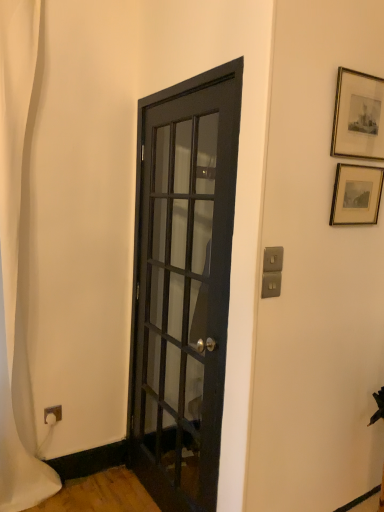
Describe the element at coordinates (356, 195) in the screenshot. This screenshot has width=384, height=512. I see `gold-framed picture at upper right, which is the first picture frame from bottom to top` at that location.

This screenshot has width=384, height=512. I want to click on matte black door at center, so click(183, 285).

I want to click on gold-framed picture at upper right, which appears as the second picture frame when viewed from the top, so click(356, 195).

Is gold-framed print at upper right, the second picture frame in the bottom-to-top sequence, outside of gold-framed picture at upper right, which appears as the second picture frame when viewed from the top?

Yes, gold-framed print at upper right, the second picture frame in the bottom-to-top sequence, is outside of gold-framed picture at upper right, which appears as the second picture frame when viewed from the top.

From a real-world perspective, who is located lower, gold-framed print at upper right, which is the first picture frame from top to bottom, or gold-framed picture at upper right, which appears as the second picture frame when viewed from the top?

gold-framed picture at upper right, which appears as the second picture frame when viewed from the top, is physically lower.

Between gold-framed print at upper right, the second picture frame in the bottom-to-top sequence, and gold-framed picture at upper right, which is the first picture frame from bottom to top, which one is positioned in front?

gold-framed print at upper right, the second picture frame in the bottom-to-top sequence.

Which object is wider, gold-framed print at upper right, the second picture frame in the bottom-to-top sequence, or gold-framed picture at upper right, which appears as the second picture frame when viewed from the top?

With larger width is gold-framed picture at upper right, which appears as the second picture frame when viewed from the top.

In the scene shown: Measure the distance between matte black door at center and white fabric shower curtain at left.

The distance of matte black door at center from white fabric shower curtain at left is 28.90 inches.

From the image's perspective, which one is positioned higher, matte black door at center or white fabric shower curtain at left?

white fabric shower curtain at left.

Based on the photo, can you tell me how much matte black door at center and white fabric shower curtain at left differ in facing direction?

There is a 90-degree angle between the facing directions of matte black door at center and white fabric shower curtain at left.

Is matte black door at center behind white fabric shower curtain at left?

No, matte black door at center is in front of white fabric shower curtain at left.

Locate an element on the screen. The height and width of the screenshot is (512, 384). picture frame that is the 2nd one when counting rightward from the white fabric shower curtain at left is located at coordinates 358,116.

Is gold-framed print at upper right, which is the first picture frame from top to bottom, to the left of white fabric shower curtain at left from the viewer's perspective?

Incorrect, gold-framed print at upper right, which is the first picture frame from top to bottom, is not on the left side of white fabric shower curtain at left.

Is gold-framed print at upper right, the second picture frame in the bottom-to-top sequence, wider than white fabric shower curtain at left?

Incorrect, the width of gold-framed print at upper right, the second picture frame in the bottom-to-top sequence, does not surpass that of white fabric shower curtain at left.

From a real-world perspective, is gold-framed picture at upper right, which appears as the second picture frame when viewed from the top, positioned above or below white fabric shower curtain at left?

In terms of real-world spatial position, gold-framed picture at upper right, which appears as the second picture frame when viewed from the top, is above white fabric shower curtain at left.

Which of these two, gold-framed picture at upper right, which appears as the second picture frame when viewed from the top, or white fabric shower curtain at left, stands shorter?

gold-framed picture at upper right, which appears as the second picture frame when viewed from the top, is shorter.

Locate an element on the screen. This screenshot has height=512, width=384. shower curtain located below the gold-framed picture at upper right, which is the first picture frame from bottom to top (from the image's perspective) is located at coordinates (15, 246).

Considering the positions of objects gold-framed picture at upper right, which is the first picture frame from bottom to top, and white fabric shower curtain at left in the image provided, who is more to the right, gold-framed picture at upper right, which is the first picture frame from bottom to top, or white fabric shower curtain at left?

gold-framed picture at upper right, which is the first picture frame from bottom to top, is more to the right.

Which is farther, (218, 283) or (336, 179)?

The point (218, 283) is more distant.

How different are the orientations of matte black door at center and gold-framed picture at upper right, which is the first picture frame from bottom to top, in degrees?

92 degrees.

From the image's perspective, is matte black door at center above or below gold-framed picture at upper right, which appears as the second picture frame when viewed from the top?

Clearly, from the image's perspective, matte black door at center is below gold-framed picture at upper right, which appears as the second picture frame when viewed from the top.

From the image's perspective, is matte black door at center below gold-framed print at upper right, which is the first picture frame from top to bottom?

Yes, from the image's perspective, matte black door at center is below gold-framed print at upper right, which is the first picture frame from top to bottom.

Does matte black door at center have a lesser width compared to gold-framed print at upper right, the second picture frame in the bottom-to-top sequence?

In fact, matte black door at center might be wider than gold-framed print at upper right, the second picture frame in the bottom-to-top sequence.

From a real-world perspective, relative to gold-framed print at upper right, which is the first picture frame from top to bottom, is matte black door at center vertically above or below?

In terms of real-world spatial position, matte black door at center is below gold-framed print at upper right, which is the first picture frame from top to bottom.

Considering the sizes of objects matte black door at center and gold-framed print at upper right, the second picture frame in the bottom-to-top sequence, in the image provided, who is taller, matte black door at center or gold-framed print at upper right, the second picture frame in the bottom-to-top sequence,?

matte black door at center.

Is white fabric shower curtain at left turned away from gold-framed print at upper right, the second picture frame in the bottom-to-top sequence?

No, gold-framed print at upper right, the second picture frame in the bottom-to-top sequence, is not at the back of white fabric shower curtain at left.

From a real-world perspective, does white fabric shower curtain at left sit lower than gold-framed print at upper right, the second picture frame in the bottom-to-top sequence?

Yes, from a real-world perspective, white fabric shower curtain at left is below gold-framed print at upper right, the second picture frame in the bottom-to-top sequence.

Is white fabric shower curtain at left positioned in front of gold-framed print at upper right, the second picture frame in the bottom-to-top sequence?

No.

Would you consider white fabric shower curtain at left to be distant from gold-framed print at upper right, which is the first picture frame from top to bottom?

white fabric shower curtain at left is positioned a significant distance from gold-framed print at upper right, which is the first picture frame from top to bottom.

Where is `picture frame above the gold-framed picture at upper right, which is the first picture frame from bottom to top (from a real-world perspective)`? picture frame above the gold-framed picture at upper right, which is the first picture frame from bottom to top (from a real-world perspective) is located at coordinates (358, 116).

Where is `door on the right of the white fabric shower curtain at left`? The width and height of the screenshot is (384, 512). door on the right of the white fabric shower curtain at left is located at coordinates (183, 285).

Considering their positions, is gold-framed print at upper right, the second picture frame in the bottom-to-top sequence, positioned further to white fabric shower curtain at left than matte black door at center?

gold-framed print at upper right, the second picture frame in the bottom-to-top sequence.

Based on their spatial positions, is gold-framed picture at upper right, which is the first picture frame from bottom to top, or white fabric shower curtain at left closer to matte black door at center?

white fabric shower curtain at left is positioned closer to the anchor matte black door at center.

Based on their spatial positions, is gold-framed print at upper right, the second picture frame in the bottom-to-top sequence, or white fabric shower curtain at left further from matte black door at center?

gold-framed print at upper right, the second picture frame in the bottom-to-top sequence.

Which object lies further to the anchor point gold-framed print at upper right, the second picture frame in the bottom-to-top sequence, matte black door at center or gold-framed picture at upper right, which is the first picture frame from bottom to top?

matte black door at center.

From the image, which object appears to be nearer to white fabric shower curtain at left, gold-framed print at upper right, the second picture frame in the bottom-to-top sequence, or gold-framed picture at upper right, which appears as the second picture frame when viewed from the top?

gold-framed print at upper right, the second picture frame in the bottom-to-top sequence.

Considering their positions, is gold-framed print at upper right, the second picture frame in the bottom-to-top sequence, positioned closer to gold-framed picture at upper right, which is the first picture frame from bottom to top, than white fabric shower curtain at left?

gold-framed print at upper right, the second picture frame in the bottom-to-top sequence, lies closer to gold-framed picture at upper right, which is the first picture frame from bottom to top, than the other object.

Estimate the real-world distances between objects in this image. Which object is further from matte black door at center, gold-framed picture at upper right, which is the first picture frame from bottom to top, or gold-framed print at upper right, which is the first picture frame from top to bottom?

Among the two, gold-framed print at upper right, which is the first picture frame from top to bottom, is located further to matte black door at center.

Based on their spatial positions, is matte black door at center or gold-framed print at upper right, the second picture frame in the bottom-to-top sequence, further from gold-framed picture at upper right, which appears as the second picture frame when viewed from the top?

The object further to gold-framed picture at upper right, which appears as the second picture frame when viewed from the top, is matte black door at center.

The height and width of the screenshot is (512, 384). I want to click on picture frame located between white fabric shower curtain at left and gold-framed print at upper right, the second picture frame in the bottom-to-top sequence, in the left-right direction, so (x=356, y=195).

At what (x,y) coordinates should I click in order to perform the action: click on door situated between white fabric shower curtain at left and gold-framed picture at upper right, which appears as the second picture frame when viewed from the top, from left to right. Please return your answer as a coordinate pair (x, y). The height and width of the screenshot is (512, 384). Looking at the image, I should click on (183, 285).

At what (x,y) coordinates should I click in order to perform the action: click on door between white fabric shower curtain at left and gold-framed print at upper right, which is the first picture frame from top to bottom, from left to right. Please return your answer as a coordinate pair (x, y). The width and height of the screenshot is (384, 512). Looking at the image, I should click on (183, 285).

You are a GUI agent. You are given a task and a screenshot of the screen. Output one action in this format:
    pyautogui.click(x=<x>, y=<y>)
    Task: Click on the picture frame located between matte black door at center and gold-framed print at upper right, the second picture frame in the bottom-to-top sequence, in the left-right direction
    This screenshot has height=512, width=384.
    Given the screenshot: What is the action you would take?
    pyautogui.click(x=356, y=195)